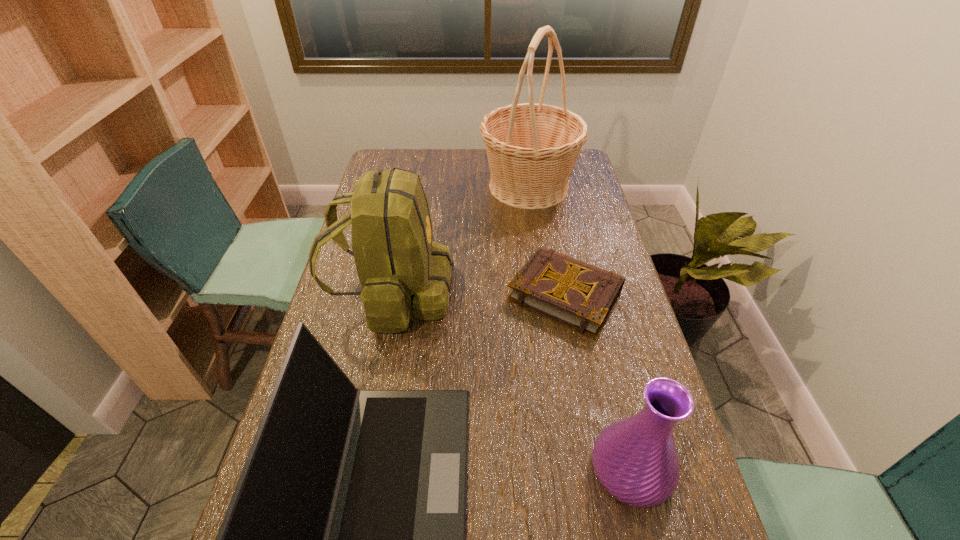
The width and height of the screenshot is (960, 540). I want to click on the tallest object, so click(532, 148).

At what (x,y) coordinates should I click in order to perform the action: click on basket. Please return your answer as a coordinate pair (x, y). Image resolution: width=960 pixels, height=540 pixels. Looking at the image, I should click on coord(532,148).

You are a GUI agent. You are given a task and a screenshot of the screen. Output one action in this format:
    pyautogui.click(x=<x>, y=<y>)
    Task: Click on the second tallest object
    
    Given the screenshot: What is the action you would take?
    pyautogui.click(x=403, y=273)

At what (x,y) coordinates should I click in order to perform the action: click on vase. Please return your answer as a coordinate pair (x, y). The width and height of the screenshot is (960, 540). Looking at the image, I should click on (635, 459).

Locate an element on the screen. The height and width of the screenshot is (540, 960). hardback book is located at coordinates (577, 294).

You are a GUI agent. You are given a task and a screenshot of the screen. Output one action in this format:
    pyautogui.click(x=<x>, y=<y>)
    Task: Click on the vacant space located on the left of the farthest object
    The image size is (960, 540).
    Given the screenshot: What is the action you would take?
    pyautogui.click(x=449, y=186)

Locate an element on the screen. The image size is (960, 540). free space located 0.330m on the front-facing side of the fourth shortest object is located at coordinates (563, 293).

Image resolution: width=960 pixels, height=540 pixels. Identify the location of free location located on the left of the vase. (563, 469).

Identify the location of free space located 0.160m on the left of the shortest object. The width and height of the screenshot is (960, 540). (453, 294).

Where is `object located at the far edge`? object located at the far edge is located at coordinates point(532,148).